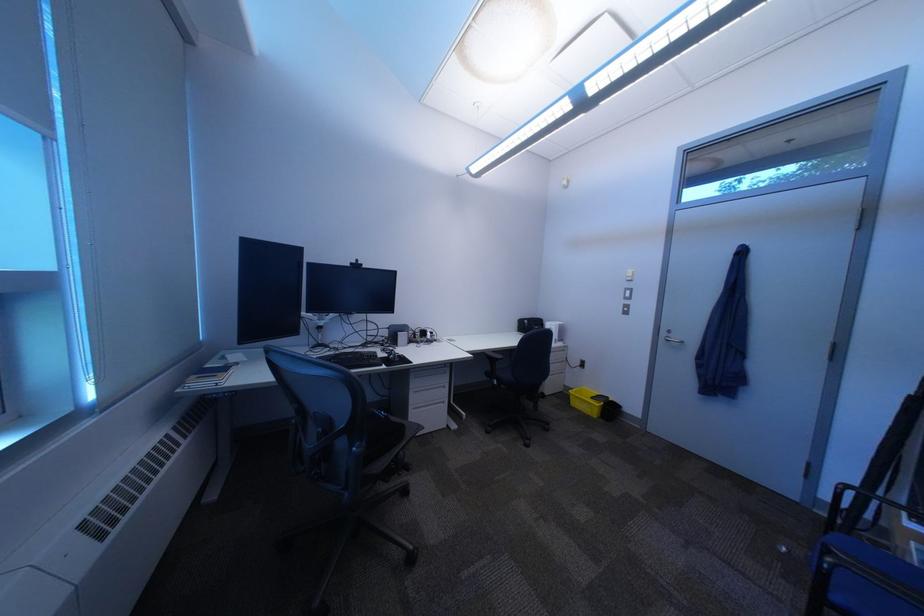
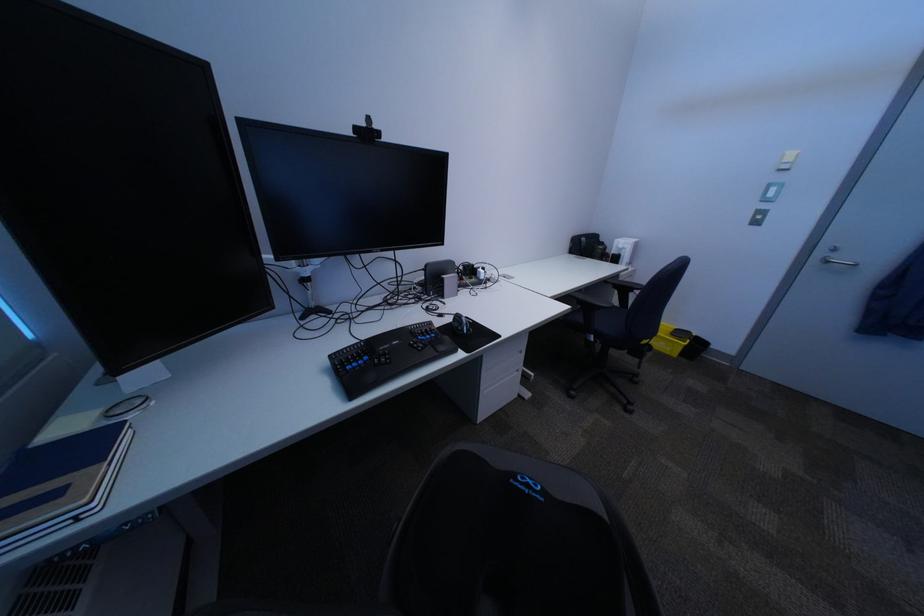
In the second image, find the point that corresponds to pixel 396 355 in the first image.

(454, 325)